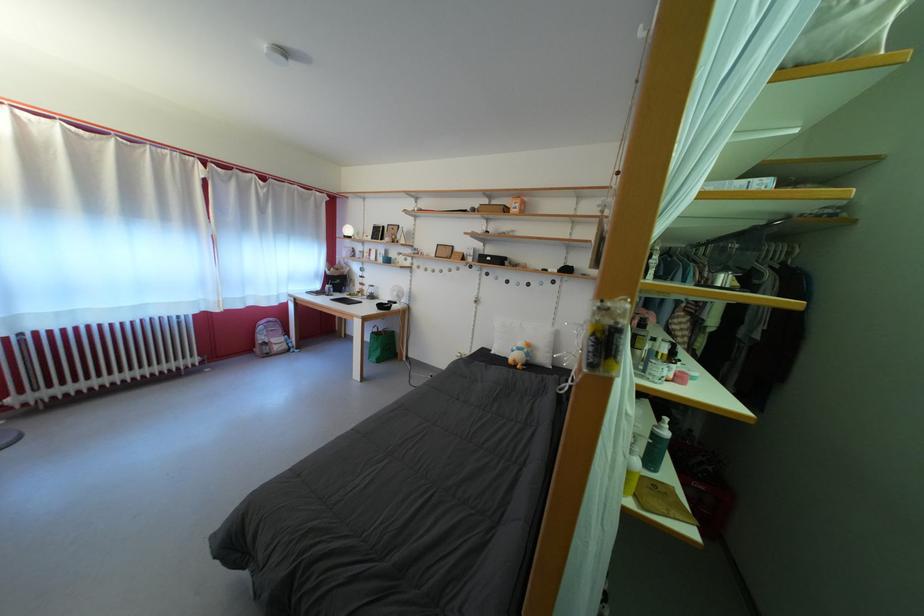
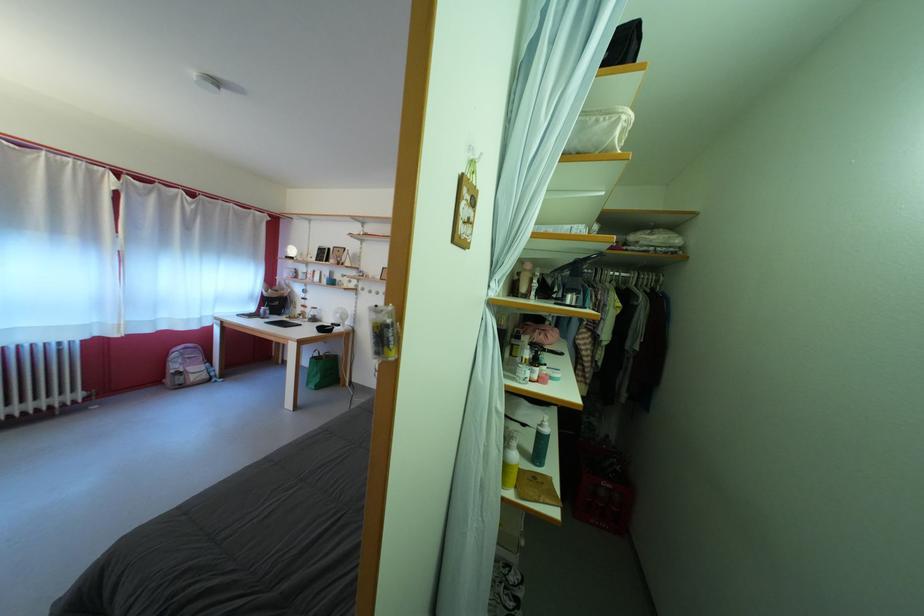
In the second image, find the point that corresponds to pixel 665 432 in the first image.

(549, 431)